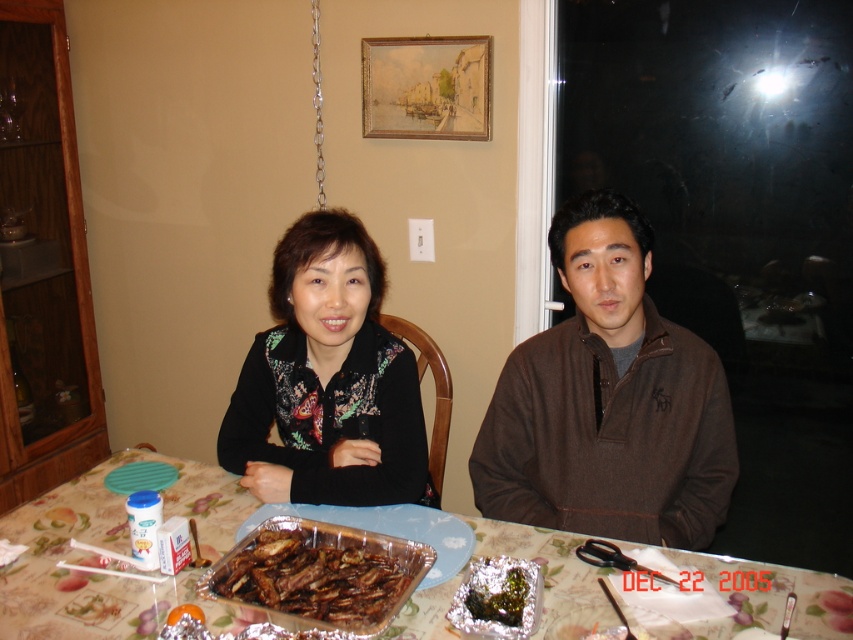
Question: Does patterned fabric tablecloth at center have a larger size compared to shiny aluminum tray at center?

Choices:
 (A) no
 (B) yes

Answer: (B)

Question: Is brown fleece jacket at center below patterned fabric tablecloth at center?

Choices:
 (A) no
 (B) yes

Answer: (A)

Question: Is patterned fabric tablecloth at center to the right of shiny aluminum tray at center from the viewer's perspective?

Choices:
 (A) yes
 (B) no

Answer: (B)

Question: Which object appears farthest from the camera in this image?

Choices:
 (A) black floral-patterned blouse at center
 (B) shiny aluminum tray at center
 (C) patterned fabric tablecloth at center

Answer: (A)

Question: Estimate the real-world distances between objects in this image. Which object is closer to the shiny aluminum tray at center?

Choices:
 (A) green mossy seaweed at center
 (B) black floral-patterned blouse at center
 (C) brown glazed ribs at center
 (D) patterned fabric tablecloth at center

Answer: (C)

Question: Which of these objects is positioned closest to the green mossy seaweed at center?

Choices:
 (A) brown fleece jacket at center
 (B) black floral-patterned blouse at center

Answer: (A)